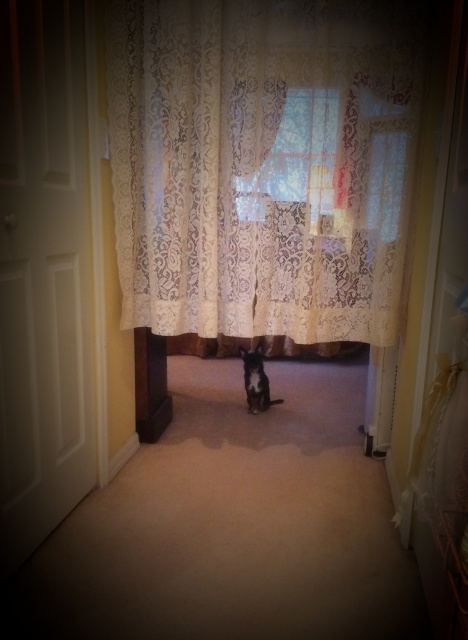
You are standing at the entrance of the hallway and want to know the exact position of the white lace curtain at center. Can you tell me its coordinates?

Result: The white lace curtain at center is located at coordinates [263,163].

You are standing at the entrance of the hallway and want to walk straight ahead towards the room. Is the white lace curtain at center in your way?

The white lace curtain at center is located at point (263, 163), which is in the center of the image. Since you are walking straight ahead towards the room, the white lace curtain at center would be directly in your path and obstruct your way.

You are a delivery person with a 1 meter wide box. You need to move through the hallway and pass between the translucent lace curtain at center and the brown wood pillar at left. Will your box fit through the space between them?

The space between the translucent lace curtain at center and the brown wood pillar at left is 92.88 centimeters. Since the box is 1 meter wide, it is slightly wider than the available space. Therefore, the box will not fit through the space between them.